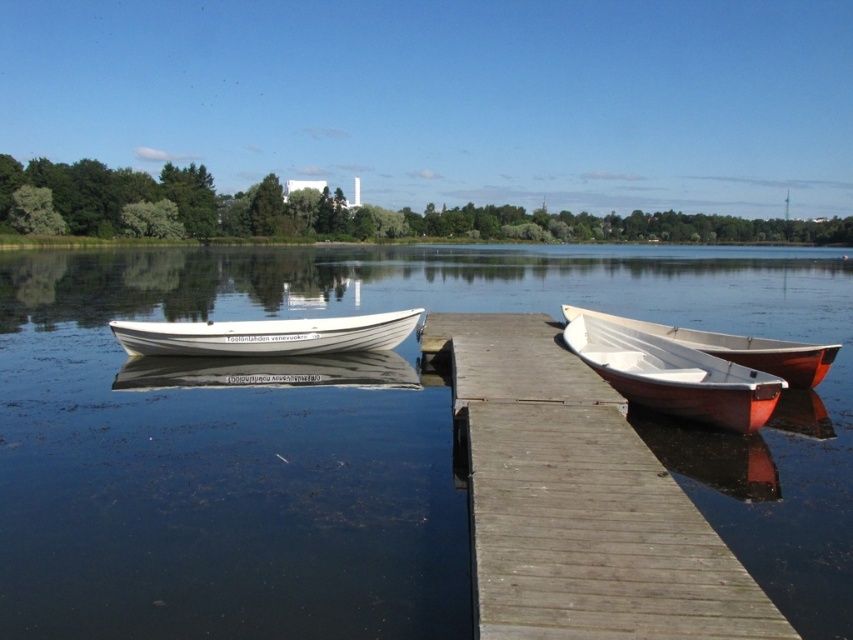
You are standing on the wooden dock at center and want to board the white wooden boat at center. Which direction should you move to reach the boat?

Since the wooden dock at center is closer to the viewer than the white wooden boat at center, you should move forward away from the shore to reach the white wooden boat at center.

You are standing at the edge of the lake and want to locate the white matte canoe at center. According to the coordinates provided, where would you look relative to your position?

The white matte canoe at center is located at coordinates point (674, 376), which means it is positioned slightly to the right and lower from your central viewpoint.

You are planning to store a white matte canoe at center and a white matte canoe at right in a storage facility. The storage facility has two slots available, one that can accommodate up to 3 meters in width and another that can hold up to 2.5 meters. Based on the scene description, which canoe should be placed in which slot to ensure they fit properly?

The white matte canoe at center should be placed in the 3 meters slot and the white matte canoe at right in the 2.5 meters slot since the white matte canoe at center is wider than the white matte canoe at right.